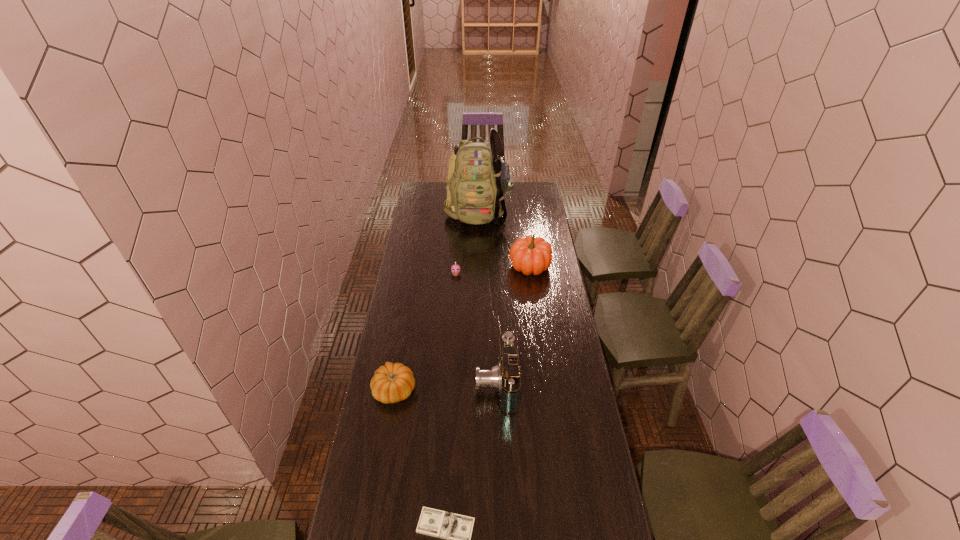
Identify the location of the farthest object. This screenshot has height=540, width=960. (478, 178).

Identify the location of the tallest object. (478, 178).

This screenshot has width=960, height=540. In order to click on pumpkin in this screenshot , I will do `click(530, 255)`.

Identify the location of camcorder. (504, 378).

At what (x,y) coordinates should I click in order to perform the action: click on the leftmost object. Please return your answer as a coordinate pair (x, y). The width and height of the screenshot is (960, 540). Looking at the image, I should click on (393, 382).

In order to click on gourd in this screenshot , I will do `click(393, 382)`.

The height and width of the screenshot is (540, 960). I want to click on cupcake, so pos(455,269).

At what (x,y) coordinates should I click in order to perform the action: click on vacant space situated 0.090m on the front-facing side of the farthest object. Please return your answer as a coordinate pair (x, y). Looking at the image, I should click on (479, 242).

Find the location of a particular element. The width and height of the screenshot is (960, 540). free space located on the left of the pumpkin is located at coordinates (446, 266).

Where is `vacant area situated 0.230m on the front-facing side of the camcorder`? The height and width of the screenshot is (540, 960). vacant area situated 0.230m on the front-facing side of the camcorder is located at coordinates (418, 383).